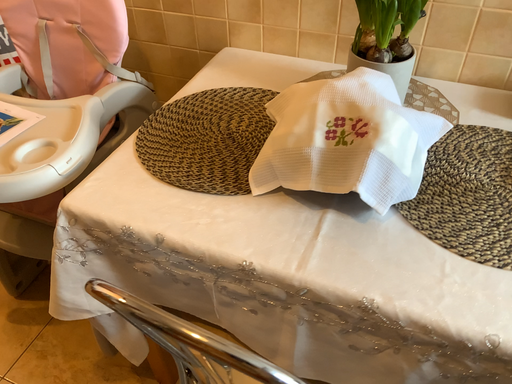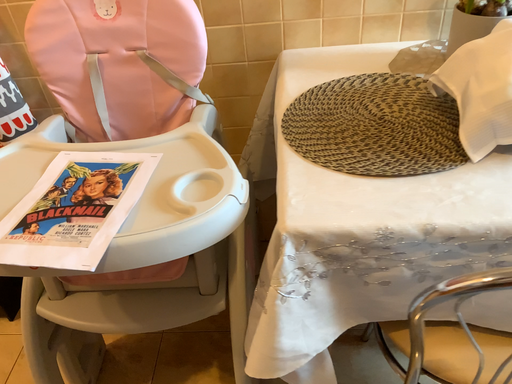
Question: Which way did the camera rotate in the video?

Choices:
 (A) rotated downward
 (B) rotated upward

Answer: (B)